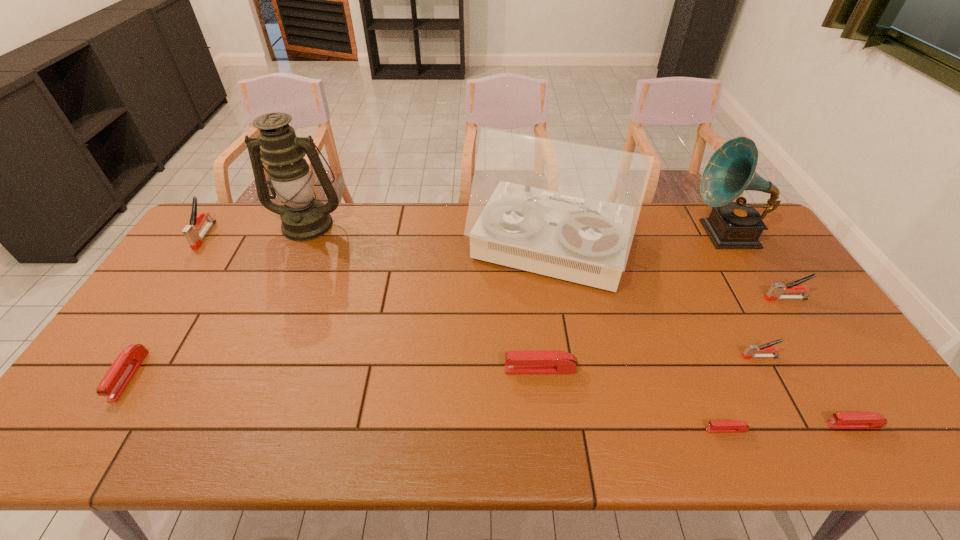
This screenshot has height=540, width=960. I want to click on the second red stapler from left to right, so click(x=537, y=361).

Locate an element on the screen. the second object from left to right is located at coordinates 119,375.

Where is `the second stapler from left to right`? The width and height of the screenshot is (960, 540). the second stapler from left to right is located at coordinates (119, 375).

The width and height of the screenshot is (960, 540). Find the location of `the rightmost red stapler`. the rightmost red stapler is located at coordinates (842, 420).

Find the location of `the sixth tallest stapler`. the sixth tallest stapler is located at coordinates (842, 420).

This screenshot has width=960, height=540. Identify the location of the fifth object from right to left. (716, 426).

You are a GUI agent. You are given a task and a screenshot of the screen. Output one action in this format:
    pyautogui.click(x=<x>, y=<y>)
    Task: Click on the second red stapler from right to left
    Image resolution: width=960 pixels, height=540 pixels.
    Given the screenshot: What is the action you would take?
    pyautogui.click(x=716, y=426)

Identify the location of vacant region located on the right of the eighth object from right to left. The image size is (960, 540). (420, 224).

Image resolution: width=960 pixels, height=540 pixels. I want to click on vacant position located on the front of the white record player, so click(580, 435).

Identify the location of vacant space located 0.200m from the horn of the eighth shortest object. The image size is (960, 540). (630, 234).